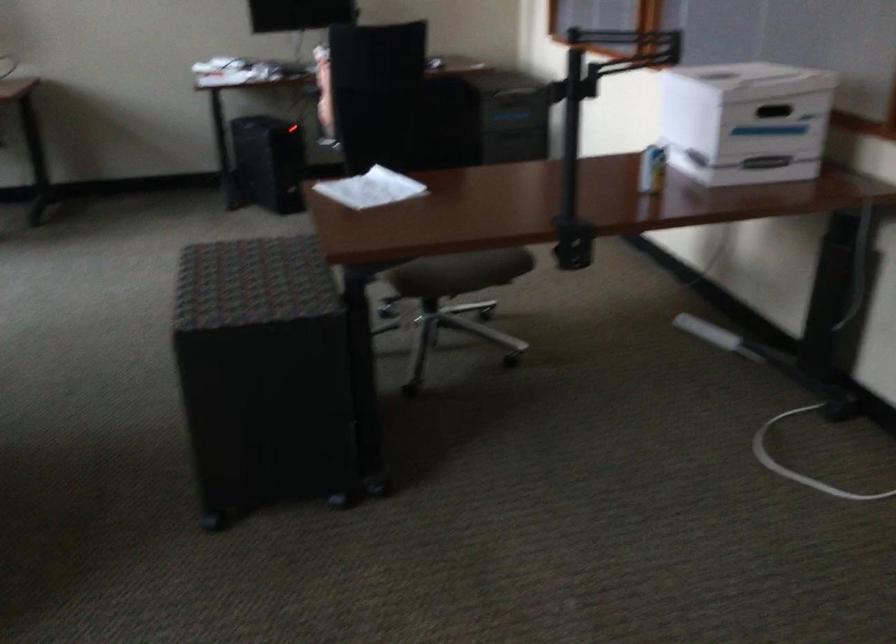
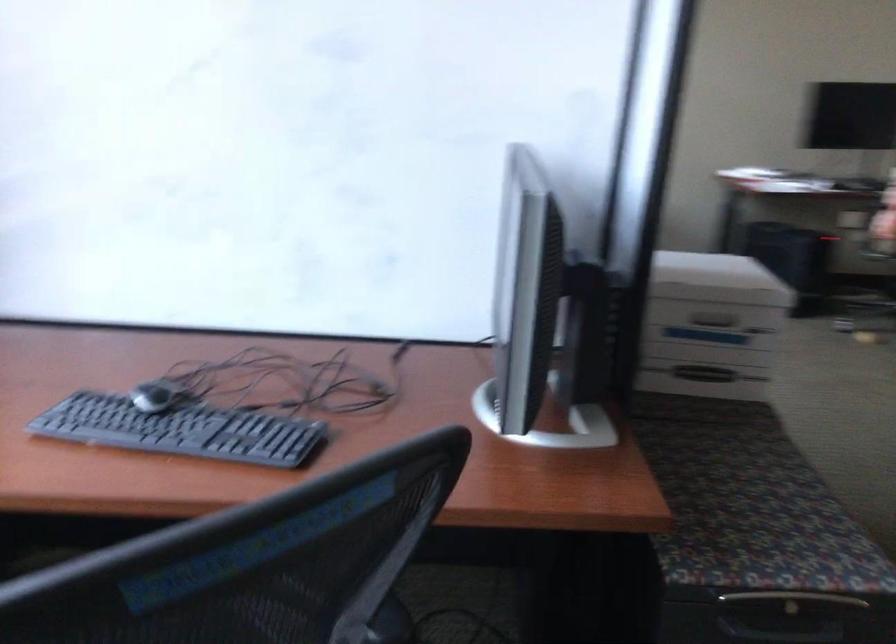
Question: The images are taken continuously from a first-person perspective. In which direction are you moving?

Choices:
 (A) Left
 (B) Right
 (C) Forward
 (D) Backward

Answer: (A)